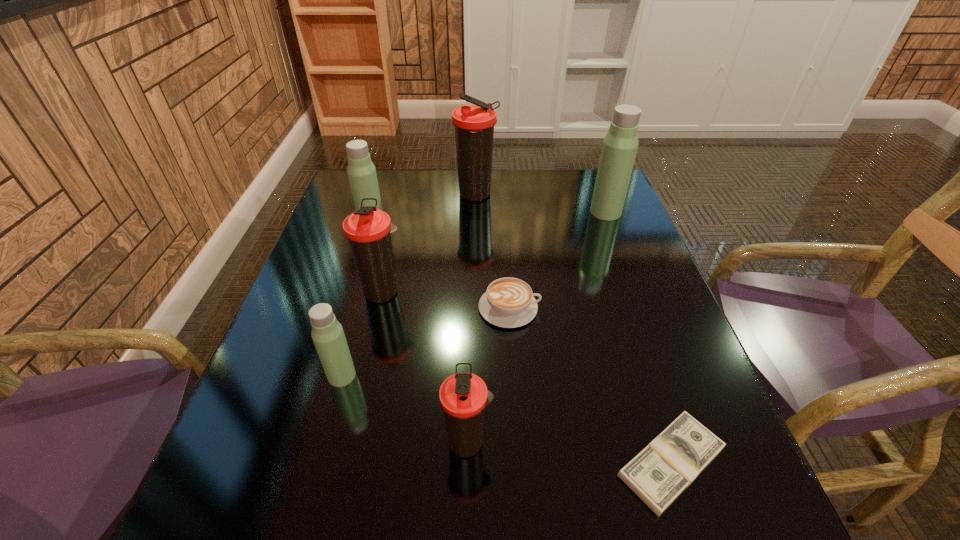
The image size is (960, 540). Identify the location of vacant area between the shortest object and the rightmost thermos bottle. (638, 338).

Image resolution: width=960 pixels, height=540 pixels. Identify the location of vacant space that is in between the biggest light thermos bottle and the second biggest light thermos bottle. coord(489,219).

At what (x,y) coordinates should I click in order to perform the action: click on vacant area between the shortest object and the second smallest light thermos bottle. Please return your answer as a coordinate pair (x, y). Looking at the image, I should click on (521, 344).

Where is `free space between the dollar and the second smallest light thermos bottle`? free space between the dollar and the second smallest light thermos bottle is located at coordinates (521, 344).

At what (x,y) coordinates should I click in order to perform the action: click on empty space that is in between the fifth farthest thermos bottle and the seventh tallest object. Please return your answer as a coordinate pair (x, y). Image resolution: width=960 pixels, height=540 pixels. Looking at the image, I should click on (425, 342).

Where is `free spot between the rightmost thermos bottle and the sixth farthest object`? free spot between the rightmost thermos bottle and the sixth farthest object is located at coordinates (473, 294).

Locate an element on the screen. This screenshot has width=960, height=540. vacant area between the nearest thermos bottle and the leftmost brown thermos bottle is located at coordinates (425, 367).

The width and height of the screenshot is (960, 540). Find the location of `vacant space that is in between the nearest thermos bottle and the dollar`. vacant space that is in between the nearest thermos bottle and the dollar is located at coordinates (569, 452).

Where is `free space between the rightmost light thermos bottle and the smallest light thermos bottle`? This screenshot has width=960, height=540. free space between the rightmost light thermos bottle and the smallest light thermos bottle is located at coordinates (473, 294).

At what (x,y) coordinates should I click in order to perform the action: click on free space between the second biggest light thermos bottle and the shortest object. Please return your answer as a coordinate pair (x, y). The image size is (960, 540). Looking at the image, I should click on (521, 344).